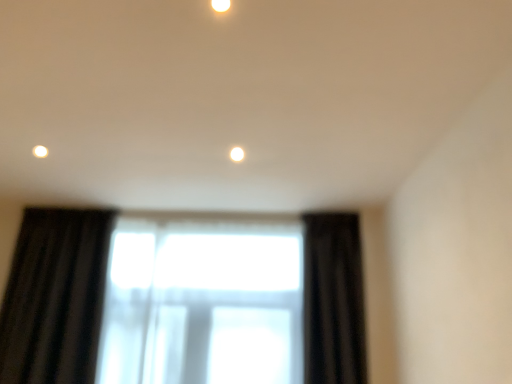
Question: Considering the relative sizes of matte white light fixture at upper center and transparent fabric at center in the image provided, is matte white light fixture at upper center taller than transparent fabric at center?

Choices:
 (A) yes
 (B) no

Answer: (B)

Question: Does matte white light fixture at upper center have a smaller size compared to transparent fabric at center?

Choices:
 (A) no
 (B) yes

Answer: (B)

Question: Is matte white light fixture at upper center outside of transparent fabric at center?

Choices:
 (A) no
 (B) yes

Answer: (B)

Question: Is matte white light fixture at upper center wider than transparent fabric at center?

Choices:
 (A) yes
 (B) no

Answer: (B)

Question: Is matte white light fixture at upper center oriented towards transparent fabric at center?

Choices:
 (A) no
 (B) yes

Answer: (A)

Question: Is transparent fabric at center situated inside matte white light fixture at upper center or outside?

Choices:
 (A) outside
 (B) inside

Answer: (A)

Question: Is transparent fabric at center in front of or behind matte white light fixture at upper center in the image?

Choices:
 (A) behind
 (B) front

Answer: (A)

Question: From a real-world perspective, is transparent fabric at center positioned above or below matte white light fixture at upper center?

Choices:
 (A) below
 (B) above

Answer: (A)

Question: Considering the positions of point (326, 319) and point (224, 3), is point (326, 319) closer or farther from the camera than point (224, 3)?

Choices:
 (A) farther
 (B) closer

Answer: (A)

Question: In terms of size, does transparent fabric at center appear bigger or smaller than black velvet curtain at right?

Choices:
 (A) big
 (B) small

Answer: (A)

Question: Is transparent fabric at center wider or thinner than black velvet curtain at right?

Choices:
 (A) wide
 (B) thin

Answer: (B)

Question: From a real-world perspective, is transparent fabric at center above or below black velvet curtain at right?

Choices:
 (A) below
 (B) above

Answer: (A)

Question: Would you say transparent fabric at center is inside or outside black velvet curtain at right?

Choices:
 (A) outside
 (B) inside

Answer: (A)

Question: Considering their positions, is matte white light fixture at upper center located in front of or behind black velvet curtain at right?

Choices:
 (A) behind
 (B) front

Answer: (B)

Question: In the image, is matte white light fixture at upper center on the left side or the right side of black velvet curtain at right?

Choices:
 (A) left
 (B) right

Answer: (A)